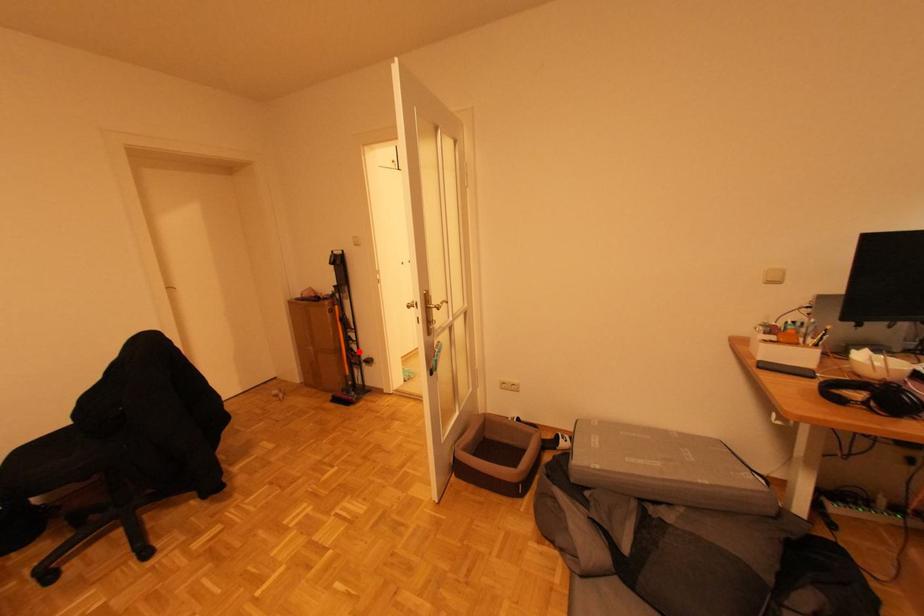
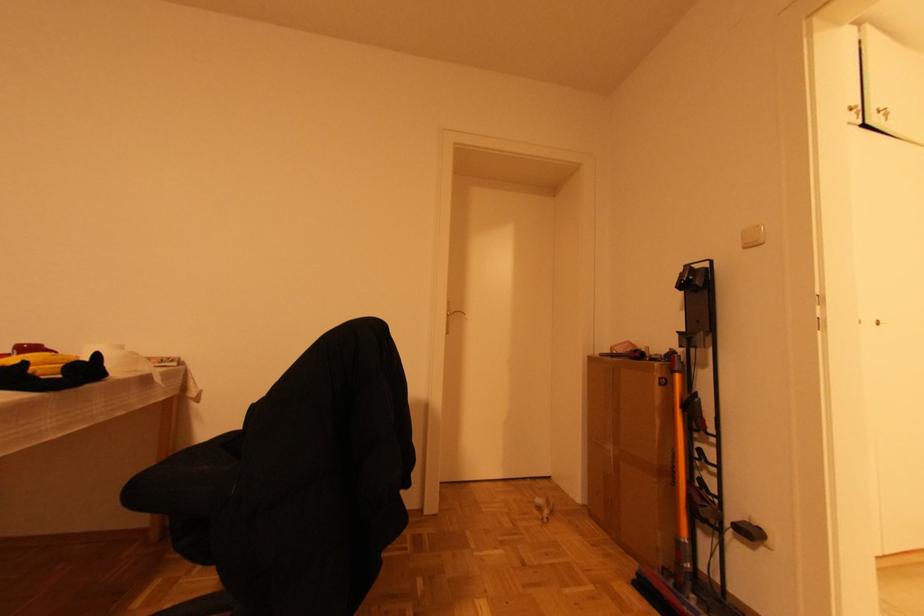
Question: I am providing you with two images of the same scene from different viewpoints. In image1, a red point is highlighted. Considering the same 3D point in image2, which of the following is correct?

Choices:
 (A) It is closer
 (B) It is farther

Answer: (A)